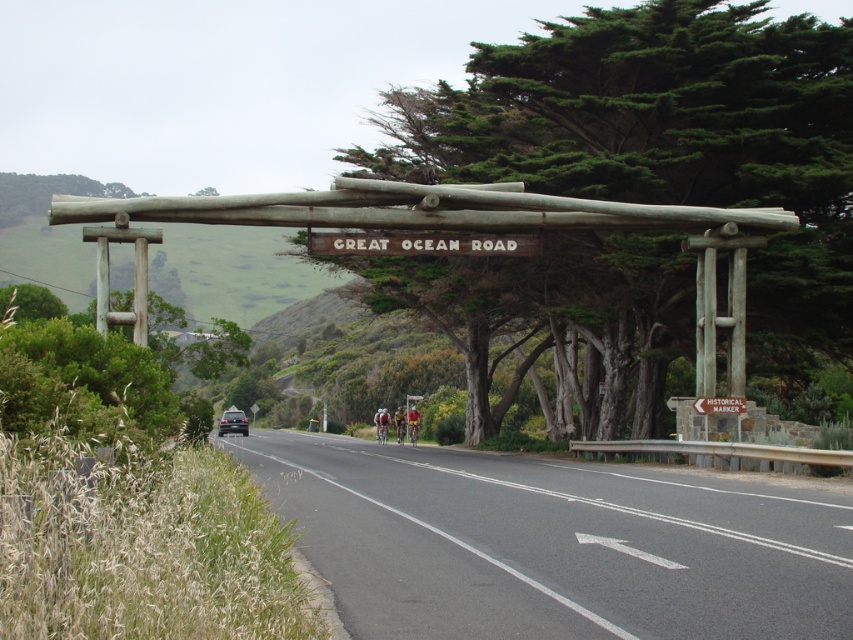
Question: Can you confirm if green textured tree at center is positioned to the right of white painted wood sign at center?

Choices:
 (A) yes
 (B) no

Answer: (B)

Question: Which of the following is the farthest from the observer?

Choices:
 (A) green textured tree at center
 (B) yellow fabric jacket at center

Answer: (B)

Question: Which is nearer to the yellow fabric helmet at center?

Choices:
 (A) white painted wood sign at center
 (B) yellow fabric jacket at center

Answer: (B)

Question: Based on their relative distances, which object is farther from the white painted wood sign at center?

Choices:
 (A) red glossy helmet at center
 (B) yellow fabric helmet at center
 (C) yellow fabric jacket at center
 (D) green textured tree at center

Answer: (A)

Question: Can you confirm if black asphalt road at center is positioned to the right of white painted wood sign at center?

Choices:
 (A) yes
 (B) no

Answer: (A)

Question: Can you confirm if black asphalt road at center is positioned above yellow fabric jacket at center?

Choices:
 (A) yes
 (B) no

Answer: (A)